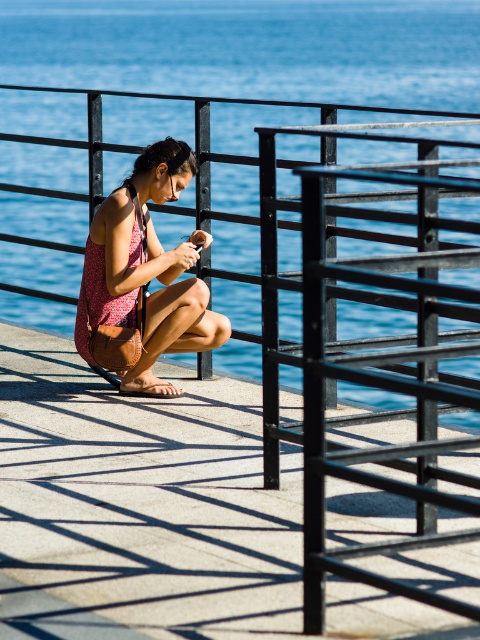
Is point (12, 465) in front of point (219, 17)?

Yes, it is.

Is matte leather dock at center closer to the viewer compared to blue water at center?

Yes, matte leather dock at center is in front of blue water at center.

The width and height of the screenshot is (480, 640). Identify the location of matte leather dock at center. (142, 502).

I want to click on matte leather dock at center, so click(x=142, y=502).

Can you confirm if matte leather dock at center is positioned below matte brown purse at center?

Indeed, matte leather dock at center is positioned under matte brown purse at center.

Is point (35, 449) behind point (128, 205)?

No, (35, 449) is in front of (128, 205).

Image resolution: width=480 pixels, height=640 pixels. Identify the location of matte leather dock at center. (142, 502).

Where is `blue water at center`? The width and height of the screenshot is (480, 640). blue water at center is located at coordinates (251, 49).

I want to click on blue water at center, so click(251, 49).